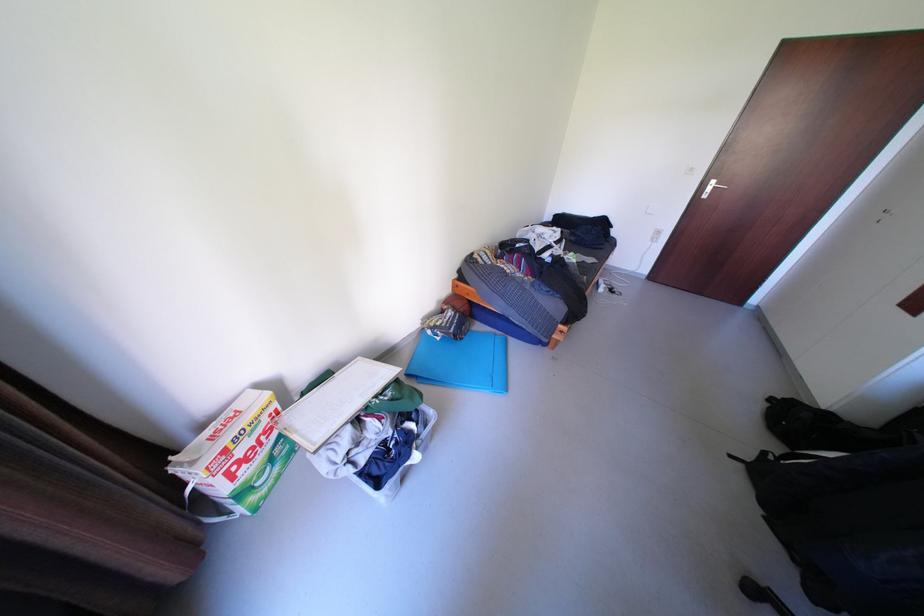
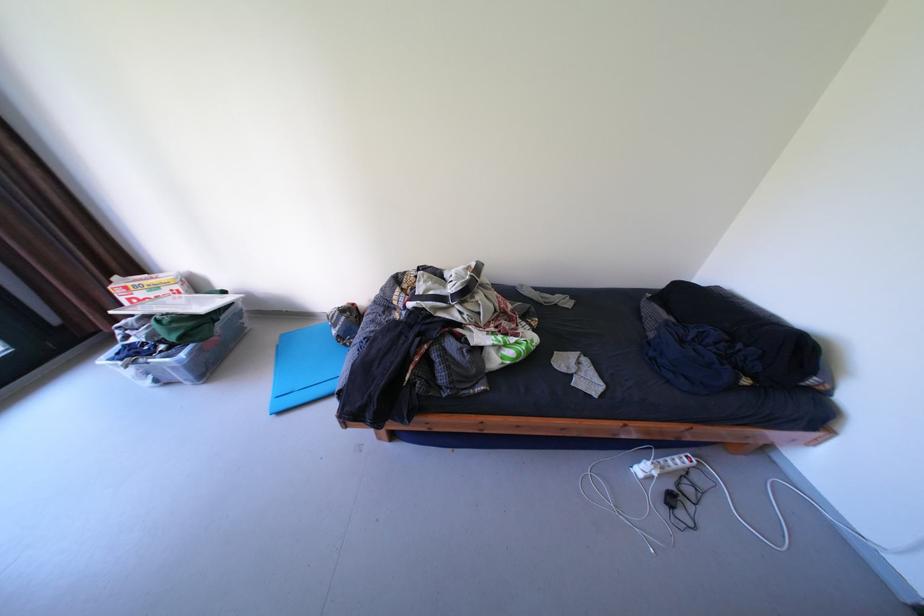
In the second image, find the point that corresponds to (286,406) in the first image.

(188, 286)